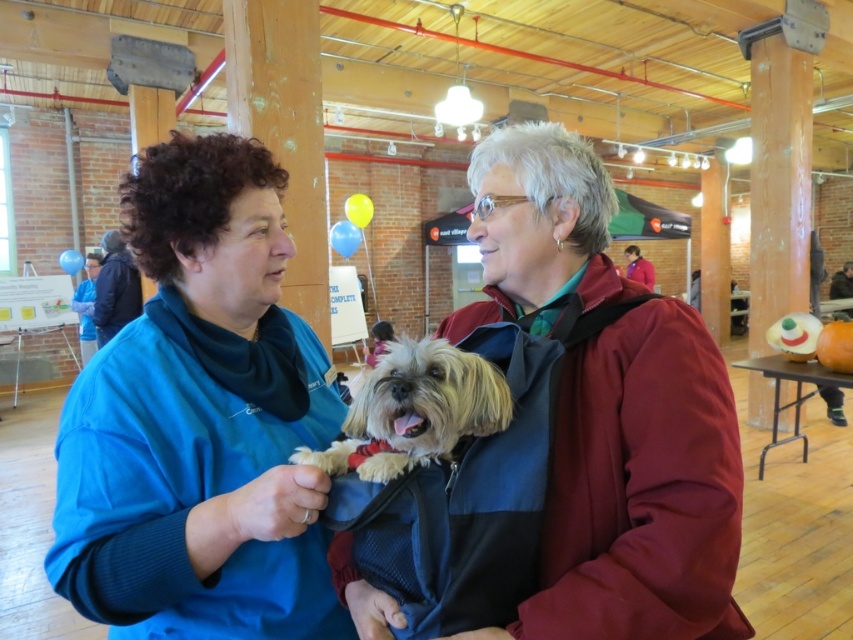
You are a photographer at the event and need to capture both the blue fleece jacket at center and the dark brown leather jacket at upper right in a single shot. Considering their sizes, which jacket will appear larger in the photo?

The blue fleece jacket at center will appear larger in the photo because it is much taller than the dark brown leather jacket at upper right.

Looking at this image, you are attending an event and need to hang your jacket on a hook that can only hold items up to 1 meter tall. You have a red fabric jacket at upper right and a dark brown leather jacket at upper right. Which jacket is more likely to fit on the hook based on their height?

The red fabric jacket at upper right has a lesser height compared to the dark brown leather jacket at upper right, so the red fabric jacket at upper right is more likely to fit on the hook since it is shorter than the 1 meter limit.

You are standing in the center of the hall and want to locate the red fabric jacket at upper right. Based on the coordinates provided, in which direction should you look to find it?

The red fabric jacket at upper right is located at coordinates point (637, 266), which means you should look towards the upper right direction from your current position in the center of the hall to find it.